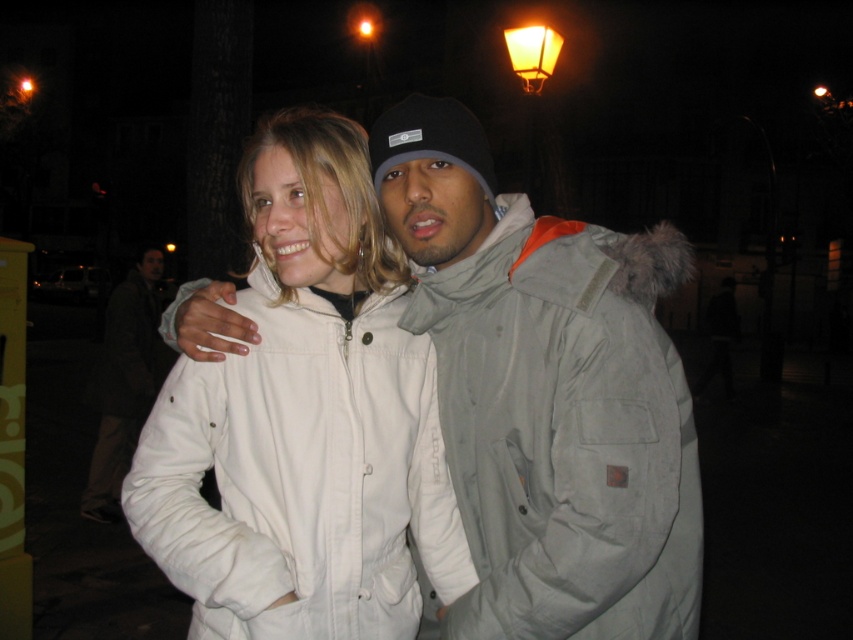
Question: Which of these objects is positioned farthest from the orange frosted glass streetlamp at upper right?

Choices:
 (A) gray fabric jacket at center
 (B) white cotton jacket at center

Answer: (A)

Question: Which of the following is the farthest from the observer?

Choices:
 (A) white matte jacket at center
 (B) orange frosted glass streetlamp at upper right
 (C) gray fabric jacket at center

Answer: (B)

Question: Is white matte jacket at center above orange frosted glass streetlamp at upper right?

Choices:
 (A) no
 (B) yes

Answer: (A)

Question: Which object is closer to the camera taking this photo?

Choices:
 (A) white cotton jacket at center
 (B) orange frosted glass streetlamp at upper right

Answer: (A)

Question: Can you confirm if white matte jacket at center is bigger than white cotton jacket at center?

Choices:
 (A) yes
 (B) no

Answer: (B)

Question: Can you confirm if white matte jacket at center is positioned above white cotton jacket at center?

Choices:
 (A) yes
 (B) no

Answer: (A)